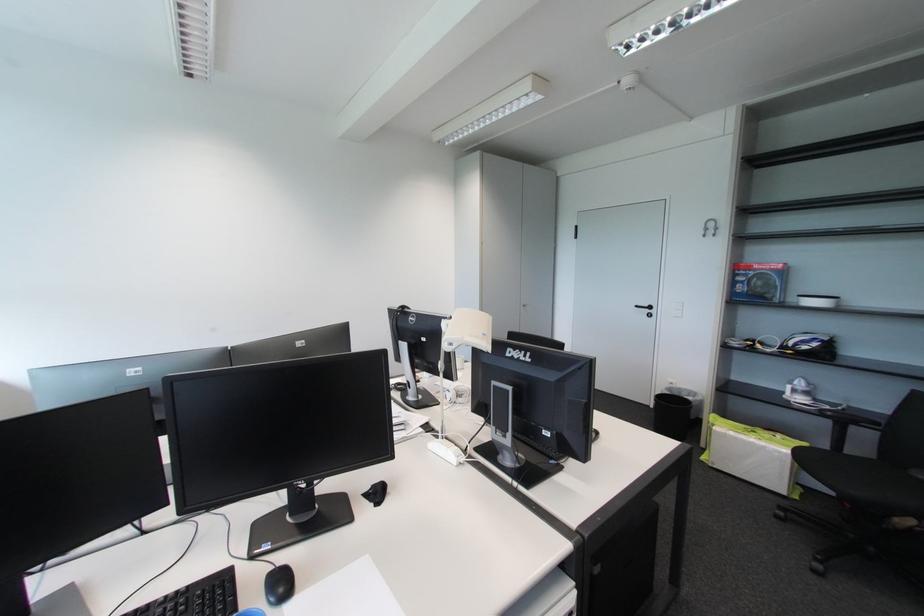
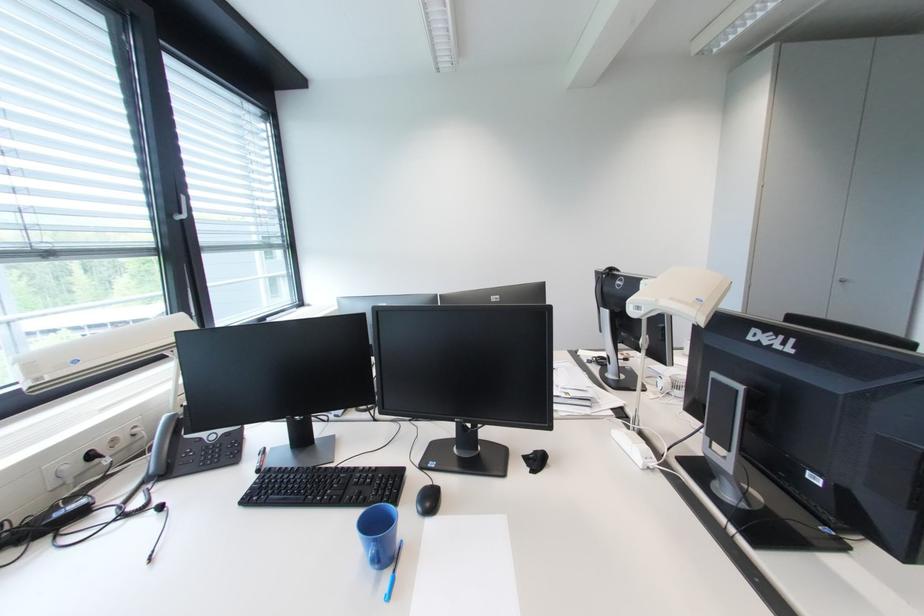
Question: The camera is either moving clockwise (left) or counter-clockwise (right) around the object. The first image is from the beginning of the video and the second image is from the end. Is the camera moving left or right when shooting the video?

Choices:
 (A) Left
 (B) Right

Answer: (B)